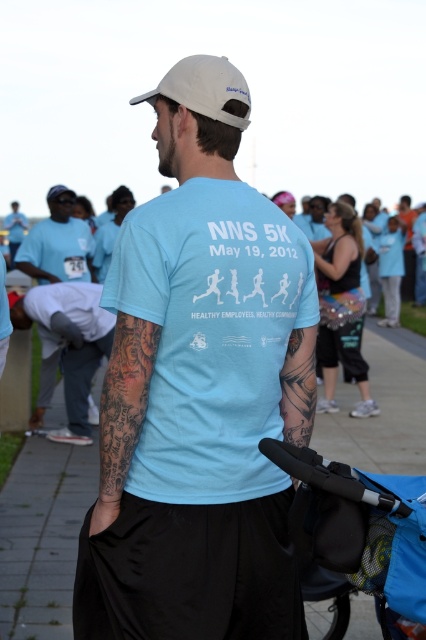
Looking at this image, you are a photographer at the NNS 5K event. You need to capture a photo where the light gray concrete pavement at center and gray fabric pants at lower left are both visible. Which object should be placed higher in the frame to ensure both are visible?

The light gray concrete pavement at center should be placed higher in the frame because it is taller than the gray fabric pants at lower left.

You are a photographer standing at the edge of the event area. You want to take a photo of the blue fabric stroller at lower right without including the light gray concrete pavement at center in the frame. Is the distance between them sufficient to allow you to zoom in on the stroller while excluding the pavement?

The distance between the light gray concrete pavement at center and the blue fabric stroller at lower right is 2.96 meters. Since the photographer can adjust the camera zoom to focus on the stroller while excluding the pavement, the distance is sufficient for this purpose.